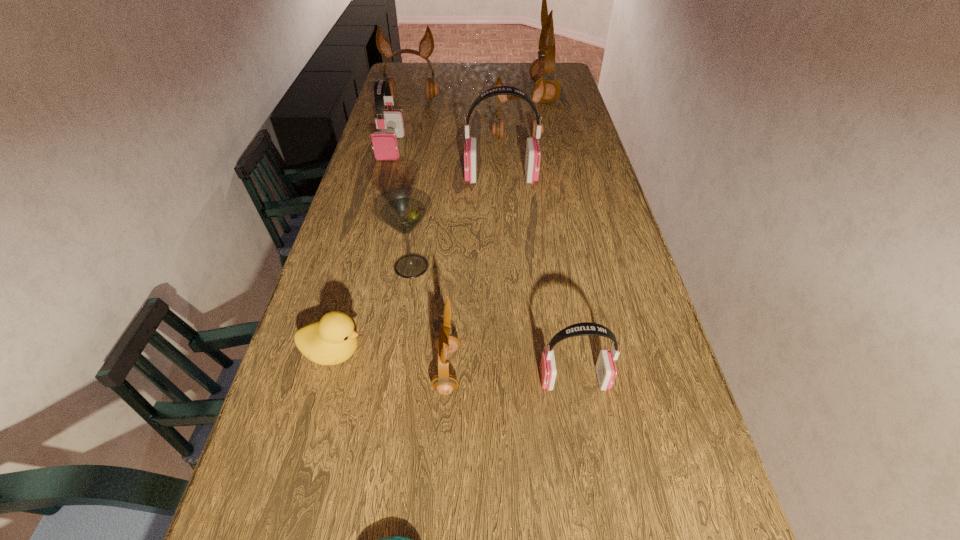
Identify the location of the smallest brown earphone. (443, 382).

The image size is (960, 540). I want to click on the smallest pink earphone, so click(x=606, y=370).

Locate an element on the screen. the second shortest object is located at coordinates (332, 340).

The height and width of the screenshot is (540, 960). Find the location of `vacant space located on the front-facing side of the tallest earphone`. vacant space located on the front-facing side of the tallest earphone is located at coordinates (444, 93).

Find the location of a particular element. blank space located on the front-facing side of the tallest earphone is located at coordinates (455, 93).

This screenshot has height=540, width=960. Find the location of `free region located on the front-facing side of the tallest earphone`. free region located on the front-facing side of the tallest earphone is located at coordinates (462, 93).

What are the coordinates of `vacant area situated on the front-facing side of the leftmost brown earphone` in the screenshot? It's located at (398, 155).

The width and height of the screenshot is (960, 540). I want to click on free space located 0.350m on the outer surface of the fifth farthest object, so click(361, 177).

The width and height of the screenshot is (960, 540). Find the location of `vacant space located 0.320m on the outer surface of the fifth farthest object`. vacant space located 0.320m on the outer surface of the fifth farthest object is located at coordinates (371, 177).

The width and height of the screenshot is (960, 540). I want to click on vacant space positioned on the outer surface of the fifth farthest object, so click(x=412, y=177).